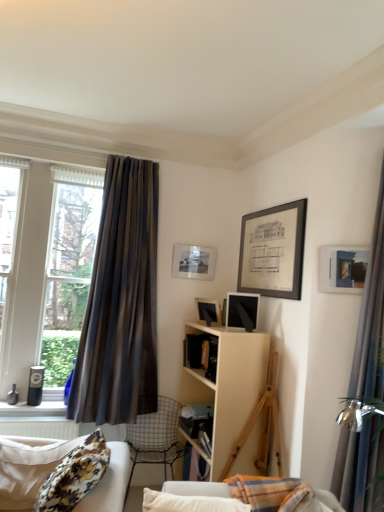
Find the location of a particular element. free space that is to the left of matte black speaker at left is located at coordinates click(x=15, y=403).